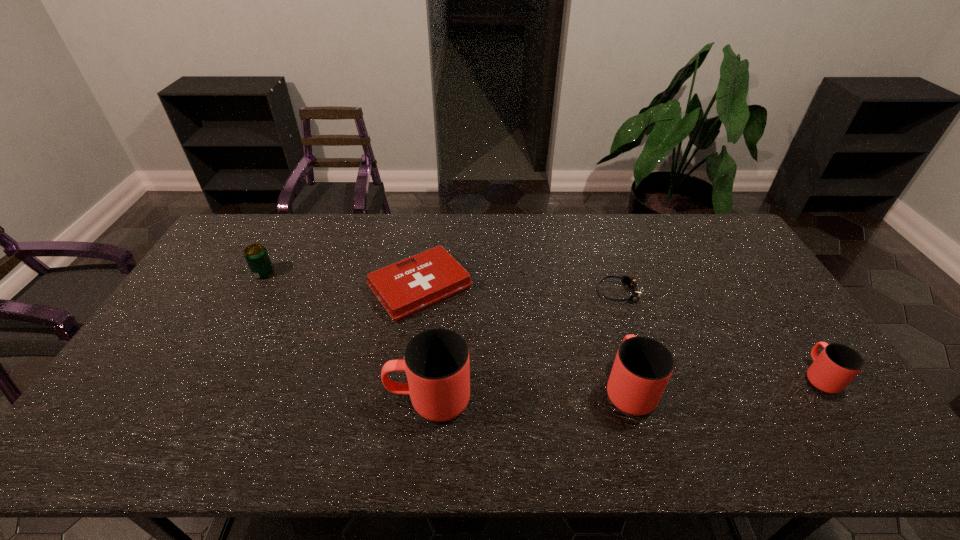
Image resolution: width=960 pixels, height=540 pixels. Identify the location of vacant area that lies between the rightmost cup and the second shortest cup. (724, 382).

Image resolution: width=960 pixels, height=540 pixels. I want to click on free space between the rightmost cup and the leftmost object, so click(x=541, y=325).

Find the location of a particular element. Image resolution: width=960 pixels, height=540 pixels. free point between the leftmost object and the rightmost object is located at coordinates (541, 325).

Find the location of a particular element. Image resolution: width=960 pixels, height=540 pixels. free space between the first-aid kit and the shortest cup is located at coordinates (620, 332).

What are the coordinates of `blank region between the beer can and the shortest cup` in the screenshot? It's located at (541, 325).

Select which object is the second closest to the shortest cup. Please provide its 2D coordinates. Your answer should be formatted as a tuple, i.e. [(x, y)], where the tuple contains the x and y coordinates of a point satisfying the conditions above.

[(643, 366)]

Identify which object is located as the nearest to the rightmost cup. Please provide its 2D coordinates. Your answer should be formatted as a tuple, i.e. [(x, y)], where the tuple contains the x and y coordinates of a point satisfying the conditions above.

[(630, 282)]

The width and height of the screenshot is (960, 540). In order to click on the second closest cup to the second shortest cup in this screenshot , I will do `click(837, 365)`.

At what (x,y) coordinates should I click in order to perform the action: click on cup that is the second closest to the shortest cup. Please return your answer as a coordinate pair (x, y). The image size is (960, 540). Looking at the image, I should click on (436, 361).

This screenshot has width=960, height=540. What are the coordinates of `blank space that satisfies the following two spatial constraints: 1. on the handle side of the leftmost cup; 2. on the handle side of the rightmost object` in the screenshot? It's located at (431, 376).